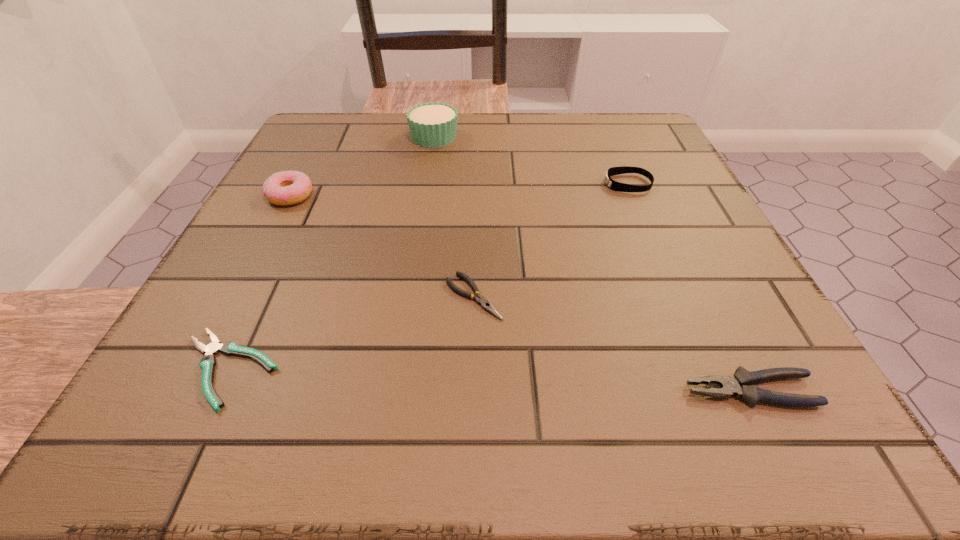
Where is `vacant area at the far left corner`? The image size is (960, 540). vacant area at the far left corner is located at coordinates (342, 151).

This screenshot has height=540, width=960. I want to click on vacant area at the far right corner, so tap(626, 133).

Locate an element on the screen. The height and width of the screenshot is (540, 960). unoccupied position between the wristband and the second tallest object is located at coordinates (459, 190).

The width and height of the screenshot is (960, 540). I want to click on free area in between the wristband and the shortest pliers, so click(428, 276).

What are the coordinates of `free point between the rightmost pliers and the wristband` in the screenshot? It's located at (689, 287).

At what (x,y) coordinates should I click in order to perform the action: click on vacant space that is in between the cupcake and the leftmost pliers. Please return your answer as a coordinate pair (x, y). This screenshot has height=540, width=960. Looking at the image, I should click on (331, 253).

This screenshot has width=960, height=540. What are the coordinates of `unoccupied area between the tallest pliers and the shortest object` in the screenshot? It's located at (490, 380).

Find the location of `empty space between the farthest object and the second tallest object`. empty space between the farthest object and the second tallest object is located at coordinates (362, 166).

Where is `free point between the farthest pliers and the fifth shortest object`? The image size is (960, 540). free point between the farthest pliers and the fifth shortest object is located at coordinates (382, 246).

Where is `vacant point located between the cupcake and the wristband`? vacant point located between the cupcake and the wristband is located at coordinates (531, 160).